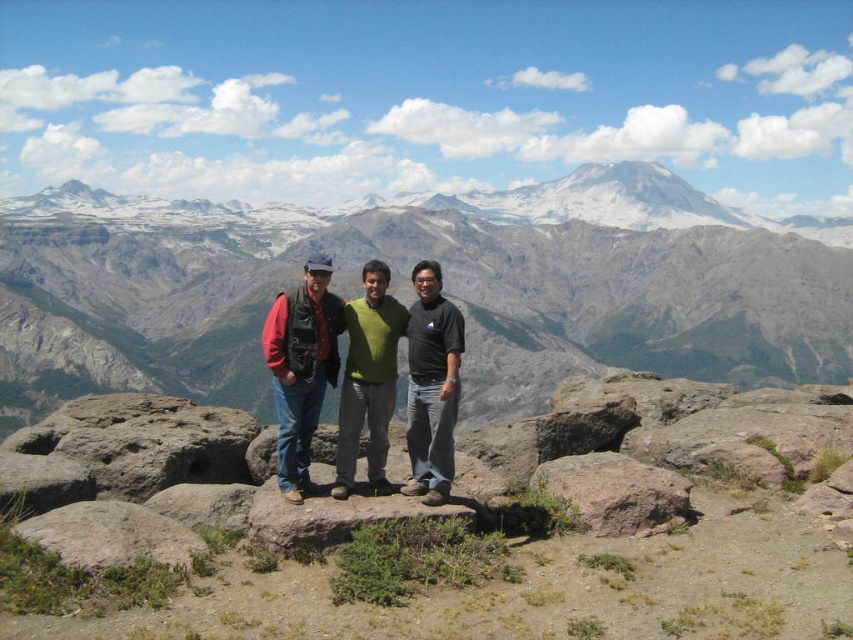
You are a photographer positioned at the origin point of the image coordinate system. You want to capture a photo of the matte black jacket at center. What are the coordinates where you should aim your camera?

The coordinates to aim your camera are at point [332,371] as that is where the matte black jacket at center is located.

You are standing at the viewpoint and want to reach the point marked as point [312,422]. Given that your average walking speed is 3 mph, how many minutes will it take you to reach that point?

The distance between you and point [312,422] is 152.69 feet. Converting this to miles, 152.69 feet is approximately 0.029 miles. At a walking speed of 3 mph, the time required is roughly 0.029 miles divided by 3 mph, which equals approximately 0.0097 hours. Converting hours to minutes, this is about 0.58 minutes, so roughly 35 seconds. Therefore, it will take approximately less than a minute to reach point [312,422].